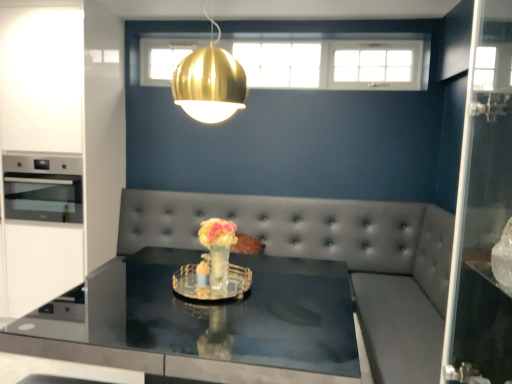
Question: Considering the relative positions of gold metallic pendant light at upper center and translucent glass vase at center in the image provided, is gold metallic pendant light at upper center to the left of translucent glass vase at center from the viewer's perspective?

Choices:
 (A) no
 (B) yes

Answer: (B)

Question: Is gold metallic pendant light at upper center directly adjacent to translucent glass vase at center?

Choices:
 (A) yes
 (B) no

Answer: (B)

Question: Does gold metallic pendant light at upper center have a smaller size compared to translucent glass vase at center?

Choices:
 (A) no
 (B) yes

Answer: (A)

Question: Does gold metallic pendant light at upper center have a greater width compared to translucent glass vase at center?

Choices:
 (A) yes
 (B) no

Answer: (A)

Question: Could you tell me if gold metallic pendant light at upper center is turned towards translucent glass vase at center?

Choices:
 (A) yes
 (B) no

Answer: (B)

Question: From the image's perspective, relative to white glossy cabinetry at left, is gold metallic pendant light at upper center above or below?

Choices:
 (A) below
 (B) above

Answer: (B)

Question: Considering the positions of gold metallic pendant light at upper center and white glossy cabinetry at left in the image, is gold metallic pendant light at upper center taller or shorter than white glossy cabinetry at left?

Choices:
 (A) tall
 (B) short

Answer: (B)

Question: Is point [x=220, y=69] positioned closer to the camera than point [x=41, y=54]?

Choices:
 (A) farther
 (B) closer

Answer: (B)

Question: Considering the relative positions of gold metallic pendant light at upper center and white glossy cabinetry at left in the image provided, is gold metallic pendant light at upper center to the left or to the right of white glossy cabinetry at left?

Choices:
 (A) left
 (B) right

Answer: (B)

Question: In the image, is stainless steel oven at left on the left side or the right side of translucent glass vase at center?

Choices:
 (A) right
 (B) left

Answer: (B)

Question: Is point (71, 198) positioned closer to the camera than point (224, 233)?

Choices:
 (A) closer
 (B) farther

Answer: (B)

Question: In terms of height, does stainless steel oven at left look taller or shorter compared to translucent glass vase at center?

Choices:
 (A) tall
 (B) short

Answer: (A)

Question: In terms of size, does stainless steel oven at left appear bigger or smaller than translucent glass vase at center?

Choices:
 (A) small
 (B) big

Answer: (B)

Question: Is translucent glass vase at center inside or outside of gold metallic pendant light at upper center?

Choices:
 (A) outside
 (B) inside

Answer: (A)

Question: In terms of width, does translucent glass vase at center look wider or thinner when compared to gold metallic pendant light at upper center?

Choices:
 (A) thin
 (B) wide

Answer: (A)